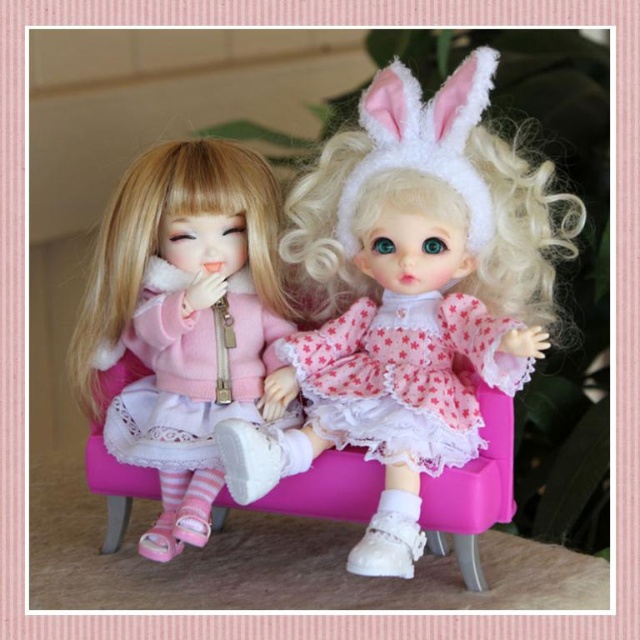
Question: Considering the relative positions of pink fabric dress at center and pink lace dress at center in the image provided, where is pink fabric dress at center located with respect to pink lace dress at center?

Choices:
 (A) left
 (B) right

Answer: (A)

Question: Is pink lace dress at center wider than matte pink fabric dress at left?

Choices:
 (A) yes
 (B) no

Answer: (A)

Question: Can you confirm if pink fabric dress at center is smaller than matte pink sweater at left?

Choices:
 (A) no
 (B) yes

Answer: (A)

Question: Which point is closer to the camera?

Choices:
 (A) matte pink fabric dress at left
 (B) pink fabric dress at center
 (C) pink lace dress at center
 (D) matte pink sweater at left

Answer: (B)

Question: Which object is positioned closest to the pink fabric dress at center?

Choices:
 (A) pink lace dress at center
 (B) matte pink fabric dress at left
 (C) matte pink sweater at left

Answer: (A)

Question: Which of these objects is positioned closest to the matte pink fabric dress at left?

Choices:
 (A) matte pink sweater at left
 (B) pink lace dress at center

Answer: (A)